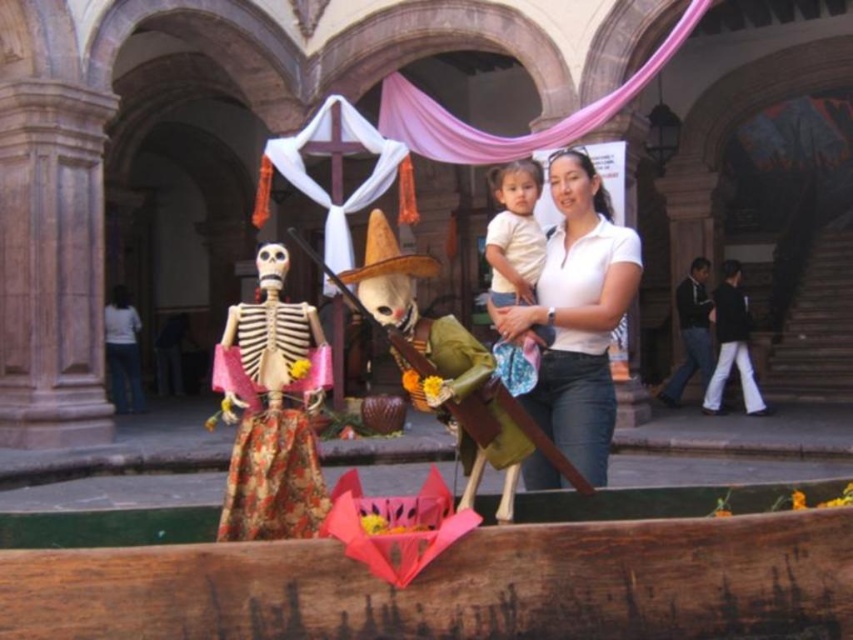
Is point (561, 304) closer to camera compared to point (544, 333)?

No, (561, 304) is behind (544, 333).

Image resolution: width=853 pixels, height=640 pixels. In order to click on white matte shirt at center in this screenshot , I will do `click(578, 314)`.

Who is positioned more to the right, white matte shirt at center or matte painted wooden skeleton at left?

white matte shirt at center

Does point (610, 323) lie in front of point (271, 486)?

No, (610, 323) is further to viewer.

You are a GUI agent. You are given a task and a screenshot of the screen. Output one action in this format:
    pyautogui.click(x=<x>, y=<y>)
    Task: Click on the white matte shirt at center
    The height and width of the screenshot is (640, 853).
    Given the screenshot: What is the action you would take?
    pyautogui.click(x=578, y=314)

Image resolution: width=853 pixels, height=640 pixels. I want to click on matte painted wooden skeleton at left, so click(270, 412).

The width and height of the screenshot is (853, 640). What do you see at coordinates (270, 412) in the screenshot? I see `matte painted wooden skeleton at left` at bounding box center [270, 412].

This screenshot has height=640, width=853. I want to click on matte painted wooden skeleton at left, so click(270, 412).